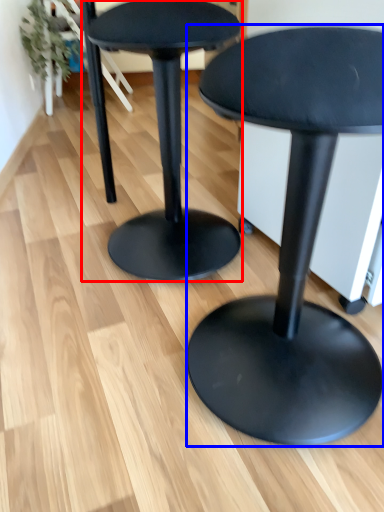
Question: Which of the following is the farthest to the observer, stool (highlighted by a red box) or stool (highlighted by a blue box)?

Choices:
 (A) stool
 (B) stool

Answer: (A)